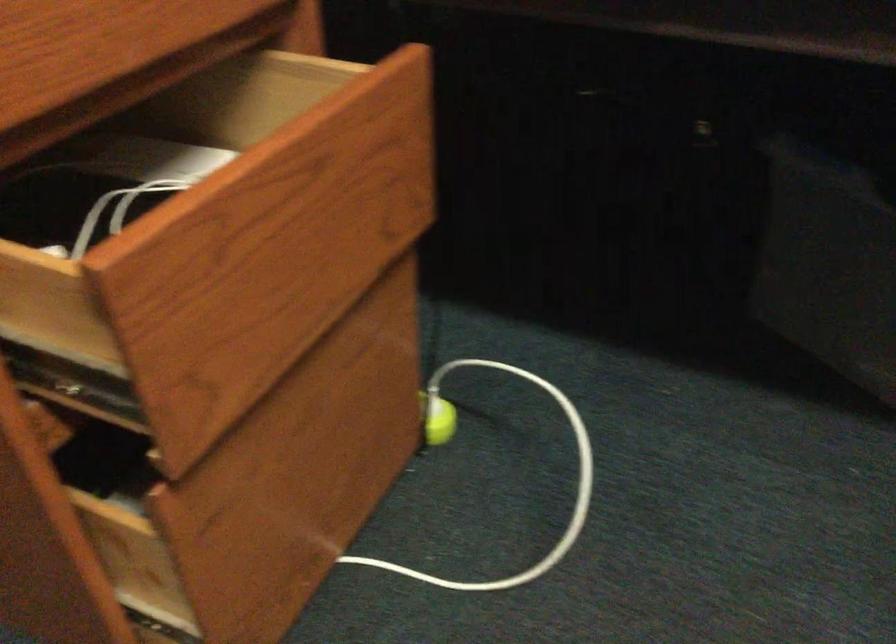
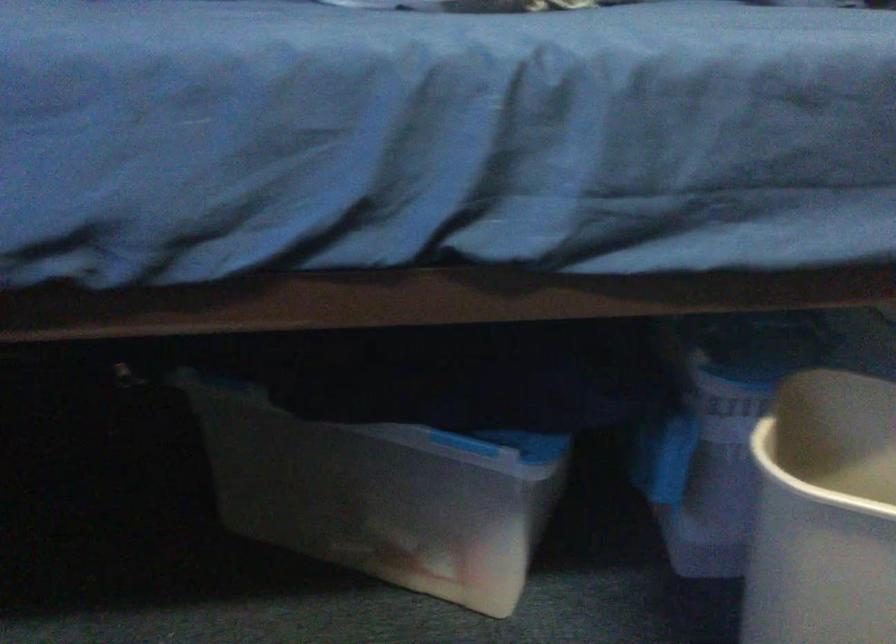
Question: The first image is from the beginning of the video and the second image is from the end. How did the camera likely rotate when shooting the video?

Choices:
 (A) Left
 (B) Right
 (C) Up
 (D) Down

Answer: (B)